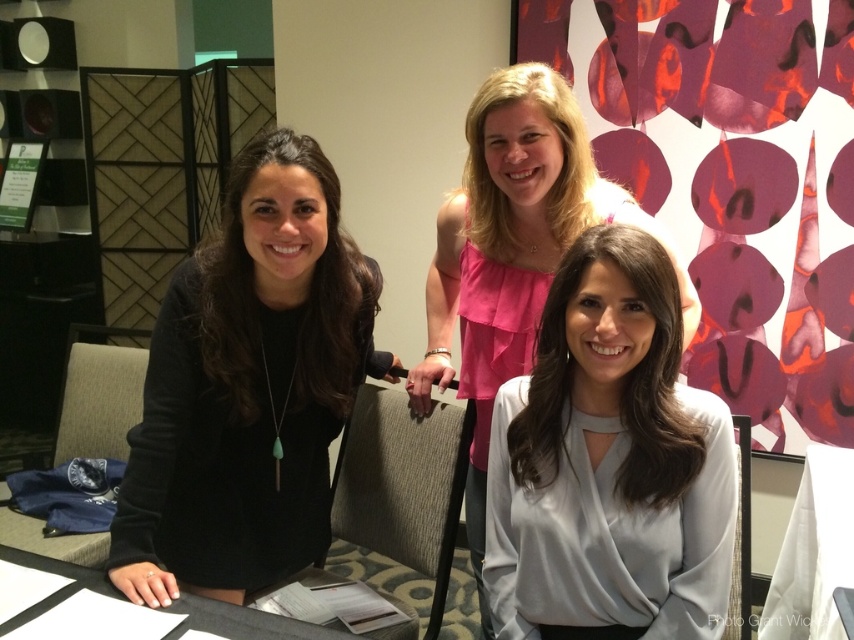
Can you confirm if satin white blouse at center is positioned above white paper at lower center?

Yes, satin white blouse at center is above white paper at lower center.

Who is shorter, satin white blouse at center or white paper at lower center?

white paper at lower center

The width and height of the screenshot is (854, 640). Describe the element at coordinates (607, 461) in the screenshot. I see `satin white blouse at center` at that location.

The height and width of the screenshot is (640, 854). Identify the location of satin white blouse at center. (607, 461).

Which of these two, black matte dress at left or white paper at lower center, stands taller?

black matte dress at left

Is point (168, 291) behind point (176, 636)?

Yes.

Who is more forward, (x=331, y=225) or (x=249, y=616)?

Point (x=249, y=616)

You are a GUI agent. You are given a task and a screenshot of the screen. Output one action in this format:
    pyautogui.click(x=<x>, y=<y>)
    Task: Click on the black matte dress at left
    The height and width of the screenshot is (640, 854).
    Given the screenshot: What is the action you would take?
    pyautogui.click(x=247, y=388)

In the scene shown: Does black matte dress at left have a lesser height compared to pink satin blouse at center?

Indeed, black matte dress at left has a lesser height compared to pink satin blouse at center.

Measure the distance between black matte dress at left and camera.

They are 1.18 meters apart.

I want to click on black matte dress at left, so click(247, 388).